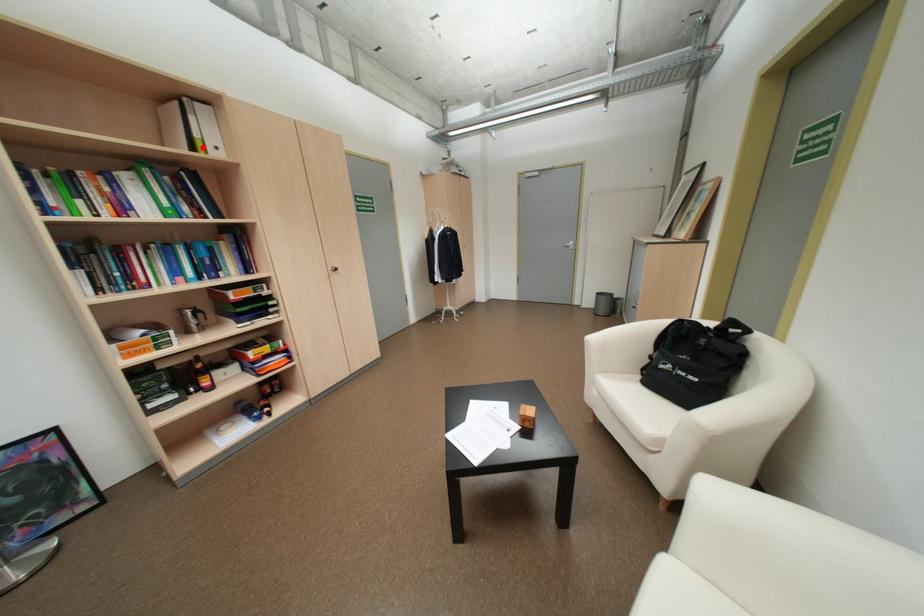
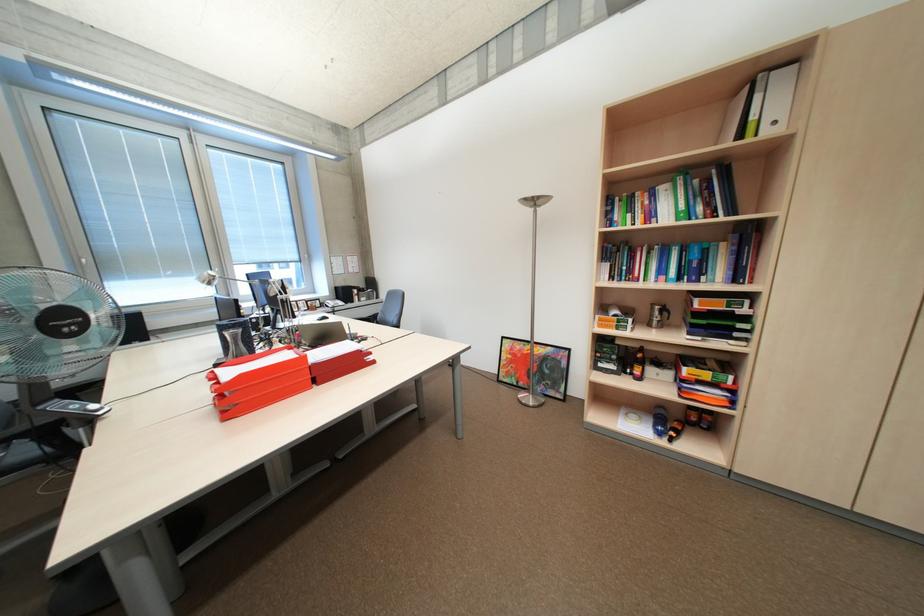
In the second image, find the point that corresponds to the highlighted location in the first image.

(749, 136)